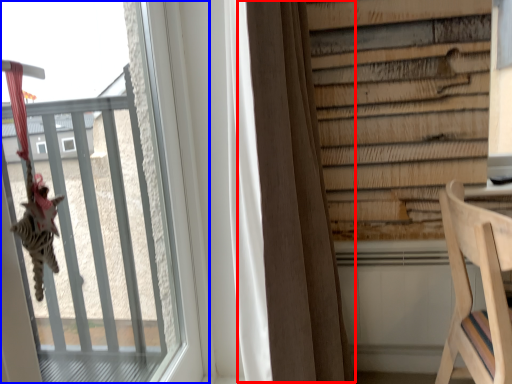
Question: Which object is closer to the camera taking this photo, curtain (highlighted by a red box) or window (highlighted by a blue box)?

Choices:
 (A) curtain
 (B) window

Answer: (B)